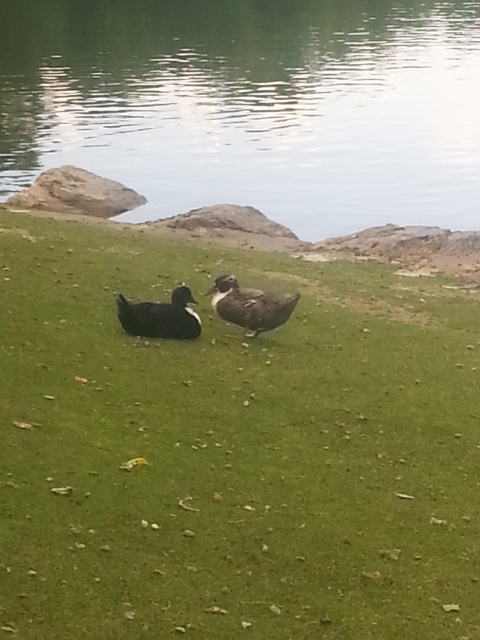
You are standing at the edge of the lakeside scene described. There are two points marked in the image. Which of these points, point (50, 632) or point (194, 321), is closer to you?

Point (50, 632) is closer to the viewer than point (194, 321).

You are a photographer trying to capture the black matte duck at center and the green grassy at center in a single shot. Based on their positions, which object is closer to the camera?

The black matte duck at center is closer to the camera because the green grassy at center is located below it, indicating the duck is positioned in front.

You are a gardener planning to place a small statue between the green grassy at center and the black matte duck at center. Based on their widths, which area should the statue be placed closer to ensure it doesn

The green grassy at center is wider than the black matte duck at center, so the statue should be placed closer to the black matte duck at center to balance the widths.